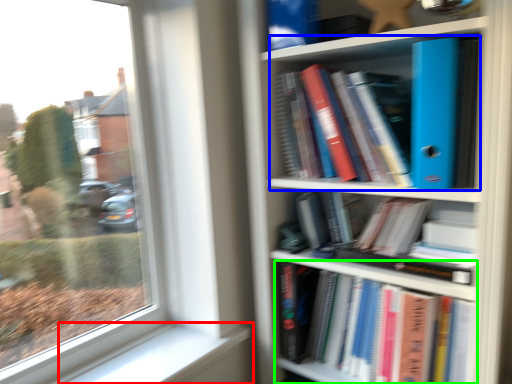
Question: Which is farther away from window sill (highlighted by a red box)? book (highlighted by a blue box) or book (highlighted by a green box)?

Choices:
 (A) book
 (B) book

Answer: (A)